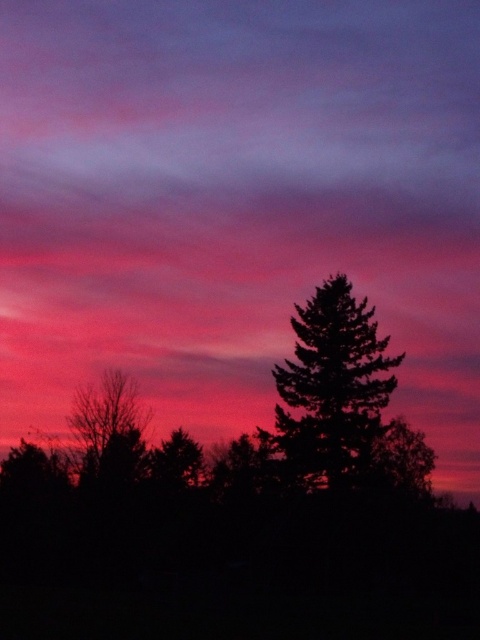
Question: Is silhouette evergreen tree at center bigger than bare branches at left?

Choices:
 (A) no
 (B) yes

Answer: (A)

Question: Can you confirm if silhouette evergreen tree at center is positioned above bare branches at left?

Choices:
 (A) yes
 (B) no

Answer: (A)

Question: Is silhouette evergreen tree at center above bare branches at left?

Choices:
 (A) no
 (B) yes

Answer: (B)

Question: Which of the following is the farthest from the observer?

Choices:
 (A) bare branches at left
 (B) silhouette evergreen tree at center

Answer: (A)